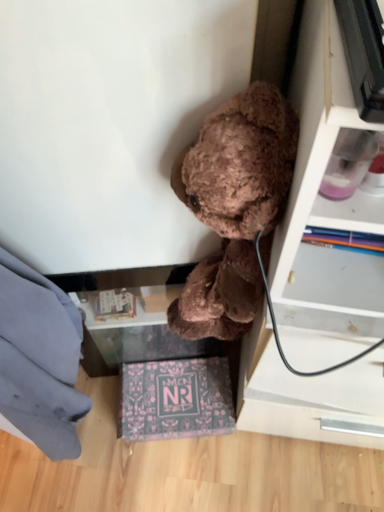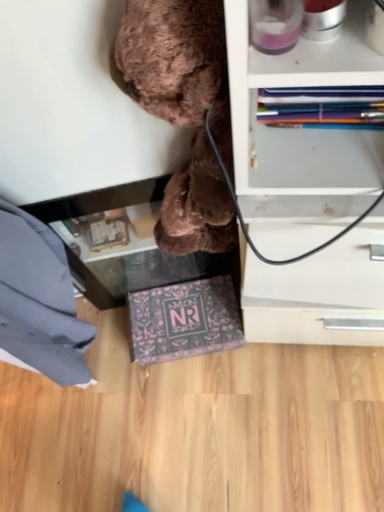
Question: How did the camera likely rotate when shooting the video?

Choices:
 (A) rotated downward
 (B) rotated upward

Answer: (A)